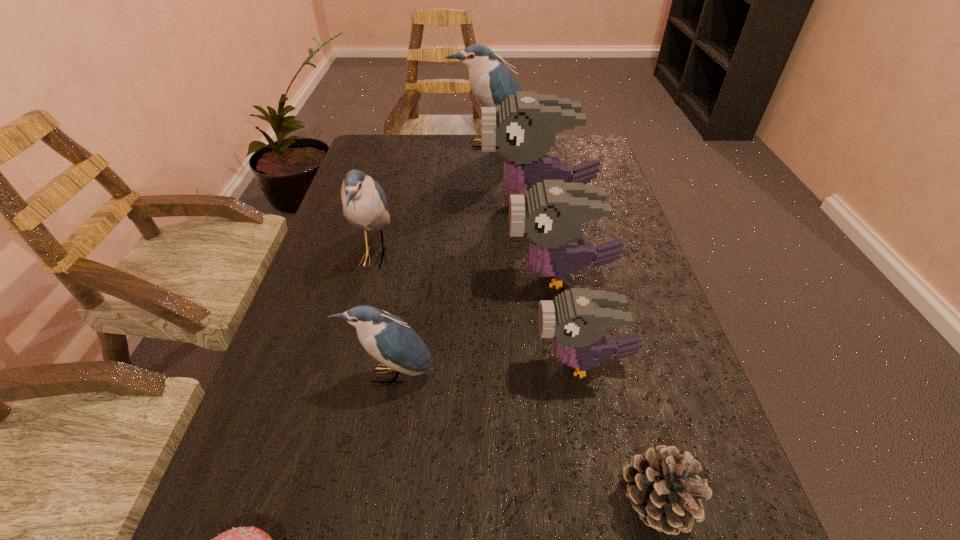
Identify which object is located as the sixth nearest to the smallest blue bird. Please provide its 2D coordinates. Your answer should be formatted as a tuple, i.e. [(x, y)], where the tuple contains the x and y coordinates of a point satisfying the conditions above.

[(524, 127)]

Locate which bird is the third closest to the nearest gray bird. Please provide its 2D coordinates. Your answer should be formatted as a tuple, i.e. [(x, y)], where the tuple contains the x and y coordinates of a point satisfying the conditions above.

[(364, 202)]

Locate which bird ranks second in proximity to the pinecone. Please provide its 2D coordinates. Your answer should be formatted as a tuple, i.e. [(x, y)], where the tuple contains the x and y coordinates of a point satisfying the conditions above.

[(387, 338)]

You are a GUI agent. You are given a task and a screenshot of the screen. Output one action in this format:
    pyautogui.click(x=<x>, y=<y>)
    Task: Click on the blue bird that stands as the closest to the nearest blue bird
    This screenshot has height=540, width=960.
    Given the screenshot: What is the action you would take?
    pyautogui.click(x=364, y=202)

I want to click on blue bird that can be found as the second closest to the pinecone, so click(364, 202).

This screenshot has height=540, width=960. In order to click on the third closest gray bird to the farthest object in this screenshot , I will do 578,318.

Locate which gray bird is the second closest to the biggest gray bird. Please provide its 2D coordinates. Your answer should be formatted as a tuple, i.e. [(x, y)], where the tuple contains the x and y coordinates of a point satisfying the conditions above.

[(578, 318)]

Find the location of `vacant position in the image that satisfies the following two spatial constraints: 1. at the tip of the farthest bird's beak; 2. at the tip of the second nearest blue bird's beak`. vacant position in the image that satisfies the following two spatial constraints: 1. at the tip of the farthest bird's beak; 2. at the tip of the second nearest blue bird's beak is located at coordinates (492, 256).

The height and width of the screenshot is (540, 960). I want to click on vacant space that satisfies the following two spatial constraints: 1. at the beak of the biggest gray bird; 2. at the tip of the nearest blue bird's beak, so click(565, 375).